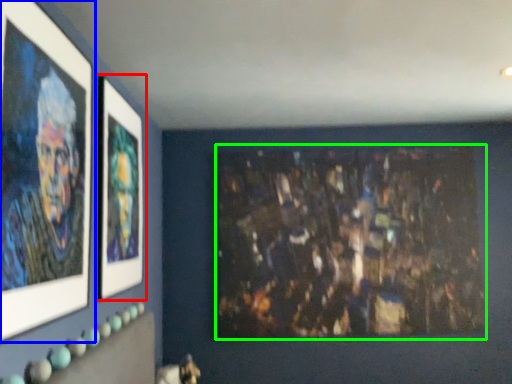
Question: Estimate the real-world distances between objects in this image. Which object is closer to picture frame (highlighted by a red box), picture frame (highlighted by a blue box) or art (highlighted by a green box)?

Choices:
 (A) picture frame
 (B) art

Answer: (A)